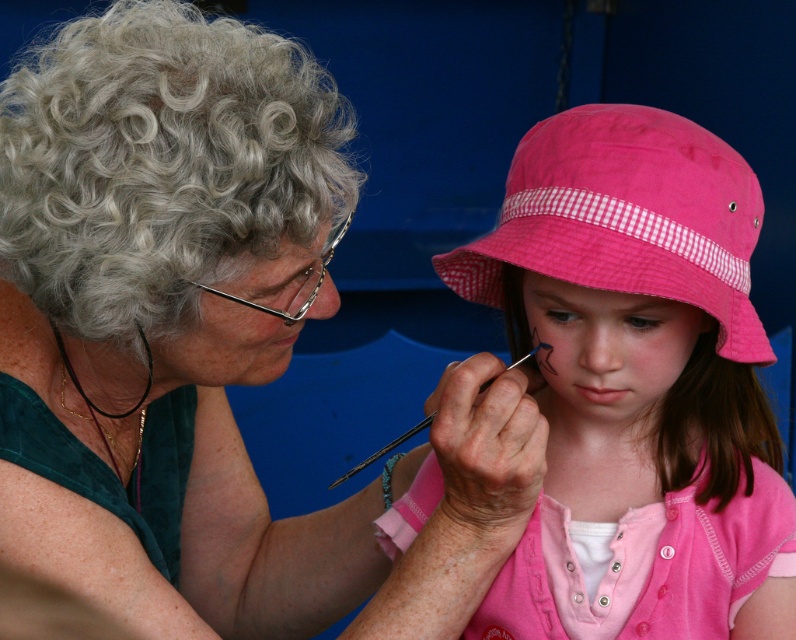
Based on the photo, who is more distant from viewer, (709, 348) or (738, 360)?

Positioned behind is point (709, 348).

Between pink fabric hat at upper right and pink cotton hat at upper right, which one appears on the left side from the viewer's perspective?

Positioned to the left is pink cotton hat at upper right.

Is point (630, 189) farther from camera compared to point (736, 348)?

No, it is in front of (736, 348).

Find the location of a particular element. This screenshot has height=640, width=796. pink fabric hat at upper right is located at coordinates click(x=635, y=385).

Is matte green blouse at center smaller than pink fabric hat at upper right?

Actually, matte green blouse at center might be larger than pink fabric hat at upper right.

From the picture: Between matte green blouse at center and pink fabric hat at upper right, which one appears on the right side from the viewer's perspective?

Positioned to the right is pink fabric hat at upper right.

Does point (428, 545) come behind point (724, 561)?

No, (428, 545) is closer to viewer.

Identify the location of matte green blouse at center. (207, 342).

This screenshot has width=796, height=640. What are the coordinates of `matte green blouse at center` in the screenshot? It's located at (207, 342).

Is matte green blouse at center thinner than pink cotton hat at upper right?

No.

Is point (525, 403) positioned in front of point (582, 134)?

No, (525, 403) is further to viewer.

Where is `matte green blouse at center`? The width and height of the screenshot is (796, 640). matte green blouse at center is located at coordinates (207, 342).